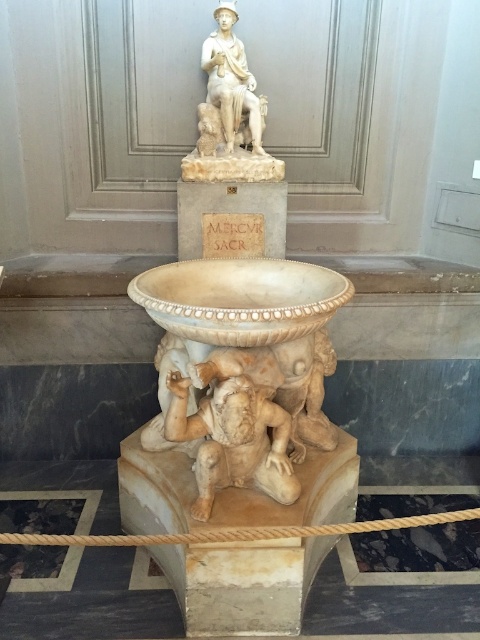
You are a museum curator planning to install a protective glass case around the marble statue at center and the white marble statue at upper center. The glass case must accommodate both statues without any part touching the glass. Given that the height of the glass case is fixed at 2 meters, can both statues fit vertically within the case?

The marble statue at center has a lesser height compared to the white marble statue at upper center. Since the glass case is 2 meters tall, both statues can fit vertically as long as their combined heights do not exceed 2 meters. However, the exact heights are not provided, so it is uncertain if they will fit without additional measurements.

From the picture: You are a museum curator arranging a new exhibit. You need to place a large potted plant in the display area so that it doesn not block the view of both the marble statue at center and the white marble statue at upper center. Where should you position the plant?

You should position the plant behind both the marble statue at center and the white marble statue at upper center since the marble statue at center is in front of the white marble statue at upper center, so placing the plant behind them will not block the view of either statue.